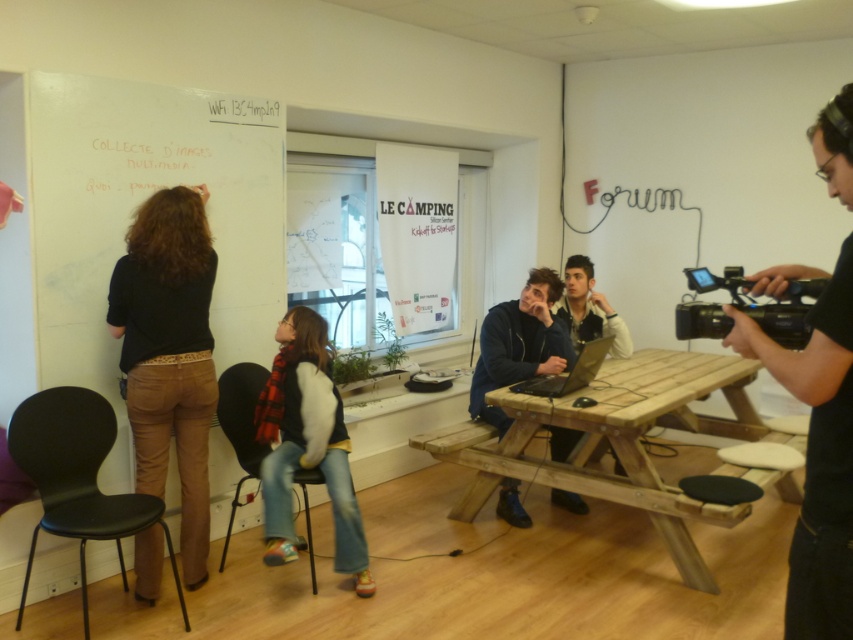
This screenshot has height=640, width=853. I want to click on black matte camera at right, so click(815, 444).

Which is below, black matte camera at right or flannel scarf at center?

flannel scarf at center is lower down.

Is point (804, 365) positioned in front of point (320, 451)?

Yes, it is in front of point (320, 451).

You are a GUI agent. You are given a task and a screenshot of the screen. Output one action in this format:
    pyautogui.click(x=<x>, y=<y>)
    Task: Click on the black matte camera at right
    
    Given the screenshot: What is the action you would take?
    pyautogui.click(x=815, y=444)

Between black plastic video camera at right and light brown leather jacket at center, which one has more height?

Standing taller between the two is light brown leather jacket at center.

Does point (761, 326) come farther from viewer compared to point (569, 285)?

No, (761, 326) is closer to viewer.

Image resolution: width=853 pixels, height=640 pixels. In order to click on black plastic video camera at right in this screenshot , I will do `click(764, 304)`.

Can you confirm if wooden picnic table at center is bigger than black matte camera at right?

Yes, wooden picnic table at center is bigger than black matte camera at right.

Does wooden picnic table at center appear on the right side of black matte camera at right?

Correct, you'll find wooden picnic table at center to the right of black matte camera at right.

Which is in front, point (490, 483) or point (828, 449)?

Positioned in front is point (828, 449).

Where is `wooden picnic table at center`? The image size is (853, 640). wooden picnic table at center is located at coordinates (614, 442).